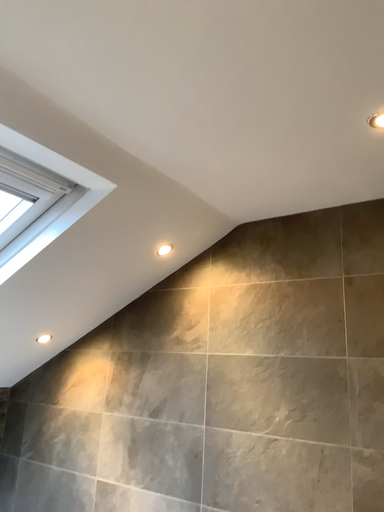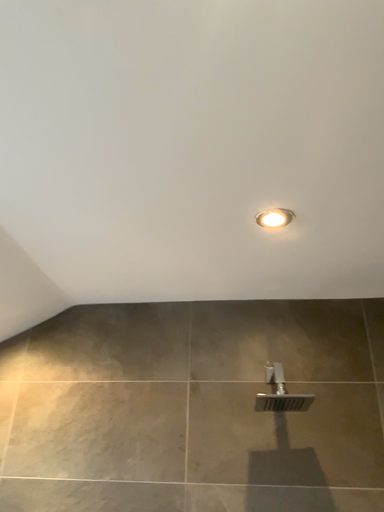
Question: Which way did the camera rotate in the video?

Choices:
 (A) rotated upward
 (B) rotated downward

Answer: (A)